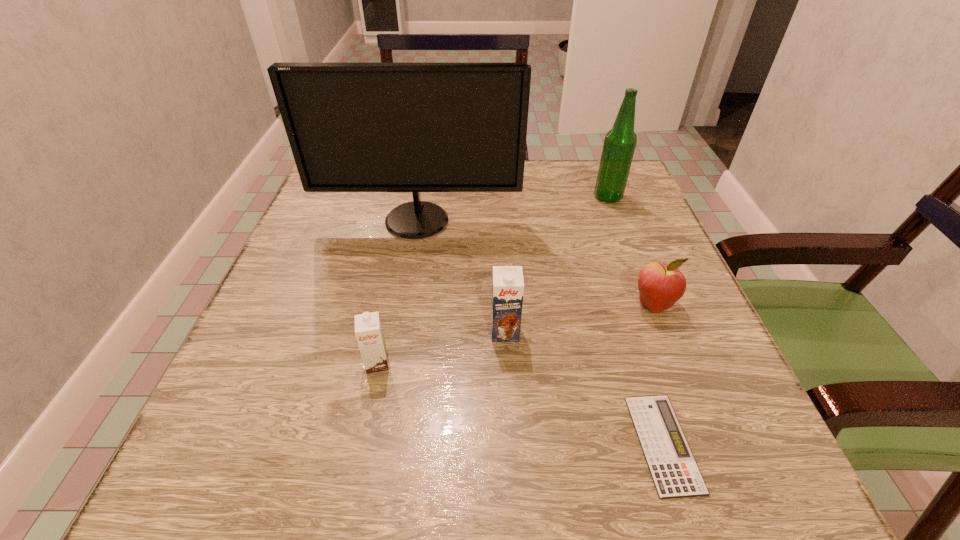
At what (x,y) coordinates should I click in order to perform the action: click on vacant region located on the label of the beer bottle. Please return your answer as a coordinate pair (x, y). The image size is (960, 540). Looking at the image, I should click on (572, 197).

Where is `vacant region located 0.220m on the label of the beer bottle`? The width and height of the screenshot is (960, 540). vacant region located 0.220m on the label of the beer bottle is located at coordinates (502, 197).

Where is `blank area located on the label of the beer bottle`? This screenshot has width=960, height=540. blank area located on the label of the beer bottle is located at coordinates (493, 197).

What are the coordinates of `free location located 0.050m on the front label of the taller chocolate milk` in the screenshot? It's located at (507, 367).

Locate an element on the screen. vacant space located 0.260m on the left of the apple is located at coordinates (488, 304).

Locate an element on the screen. The width and height of the screenshot is (960, 540). vacant area situated 0.170m on the left of the shorter chocolate milk is located at coordinates (258, 363).

Where is `free space located 0.330m on the back of the shortest object`? The width and height of the screenshot is (960, 540). free space located 0.330m on the back of the shortest object is located at coordinates (604, 255).

Identify the location of computer monitor at the far edge. (352, 127).

The width and height of the screenshot is (960, 540). I want to click on beer bottle present at the far edge, so click(619, 145).

I want to click on object present at the near edge, so click(675, 473).